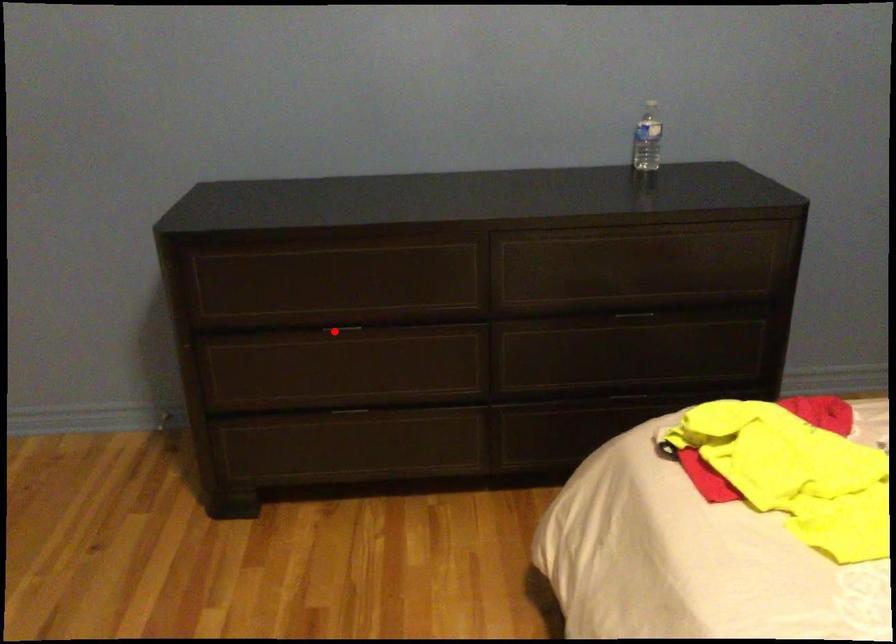
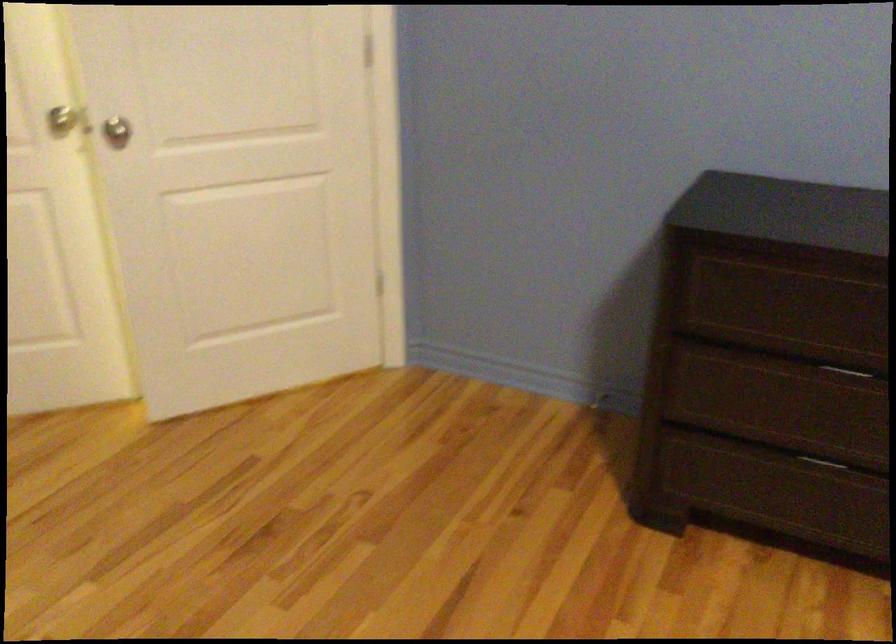
Question: I am providing you with two images of the same scene from different viewpoints. Given a red point in image1, look at the same physical point in image2. Is it:

Choices:
 (A) Closer to the viewpoint
 (B) Farther from the viewpoint

Answer: (A)